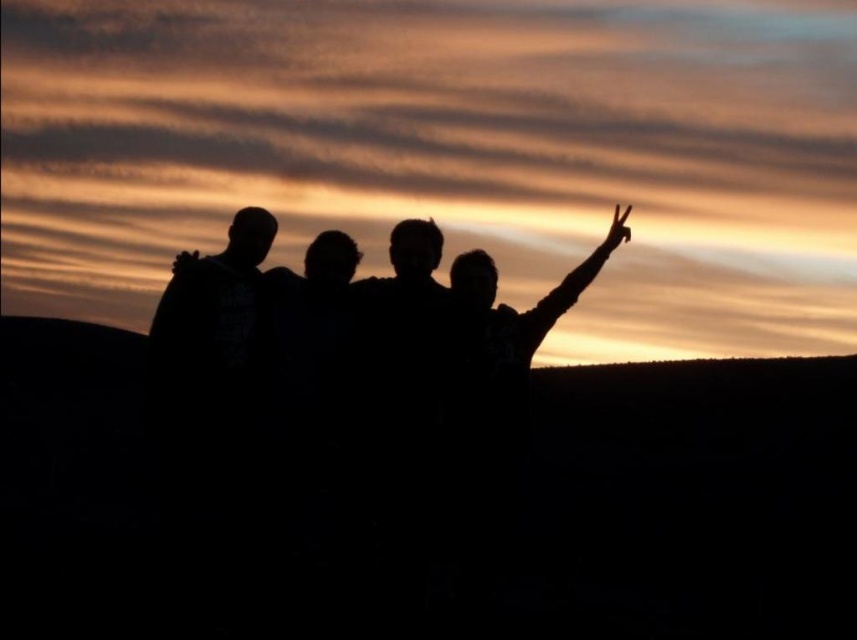
Question: Is black matte arm at upper right above matte black hand at upper right?

Choices:
 (A) yes
 (B) no

Answer: (B)

Question: Among these objects, which one is nearest to the camera?

Choices:
 (A) black matte hand at center
 (B) black matte hillside at lower left
 (C) matte black hand at upper right
 (D) black matte arm at upper right

Answer: (B)

Question: Which of these objects is positioned closest to the black matte hillside at lower left?

Choices:
 (A) black matte arm at upper left
 (B) black matte hand at center
 (C) black matte arm at upper right
 (D) matte black hand at upper right

Answer: (A)

Question: From the image, what is the correct spatial relationship of black matte arm at upper right in relation to matte black hand at upper right?

Choices:
 (A) below
 (B) above

Answer: (A)

Question: Does black matte arm at upper right have a larger size compared to black matte hand at center?

Choices:
 (A) no
 (B) yes

Answer: (B)

Question: Which of the following is the farthest from the observer?

Choices:
 (A) (615, 225)
 (B) (190, 252)

Answer: (B)